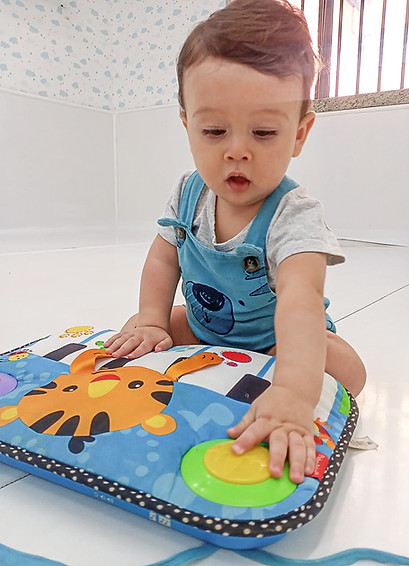
This screenshot has height=566, width=409. Identify the location of floor. (397, 375).